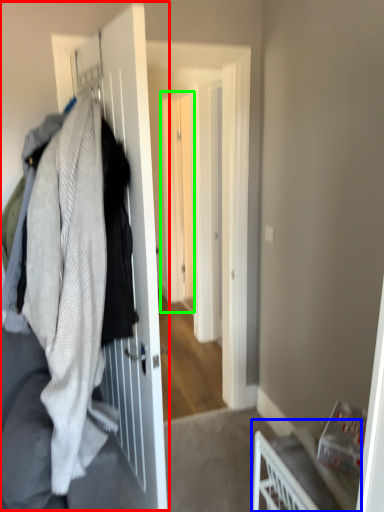
Question: Estimate the real-world distances between objects in this image. Which object is closer to closet (highlighted by a red box), furniture (highlighted by a blue box) or screen door (highlighted by a green box)?

Choices:
 (A) furniture
 (B) screen door

Answer: (A)